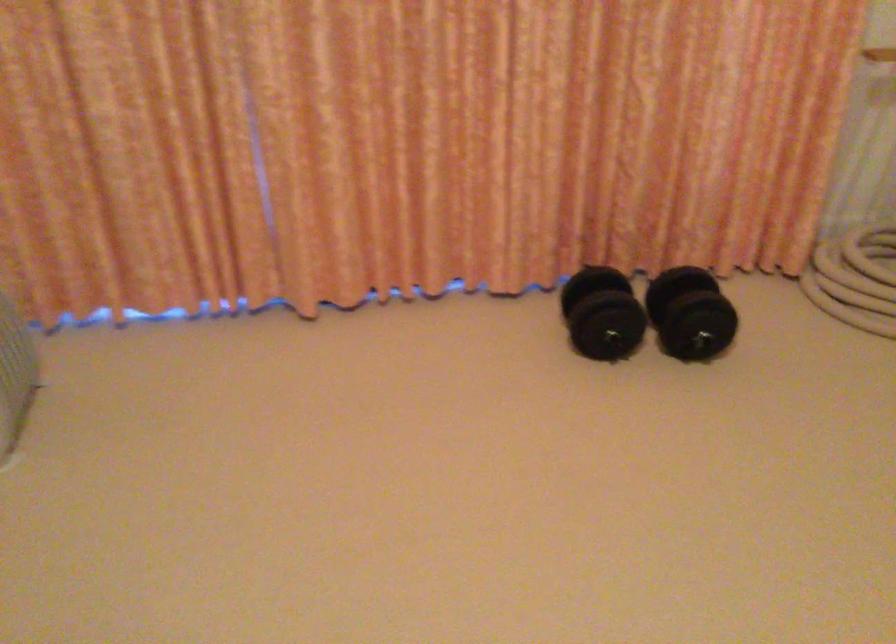
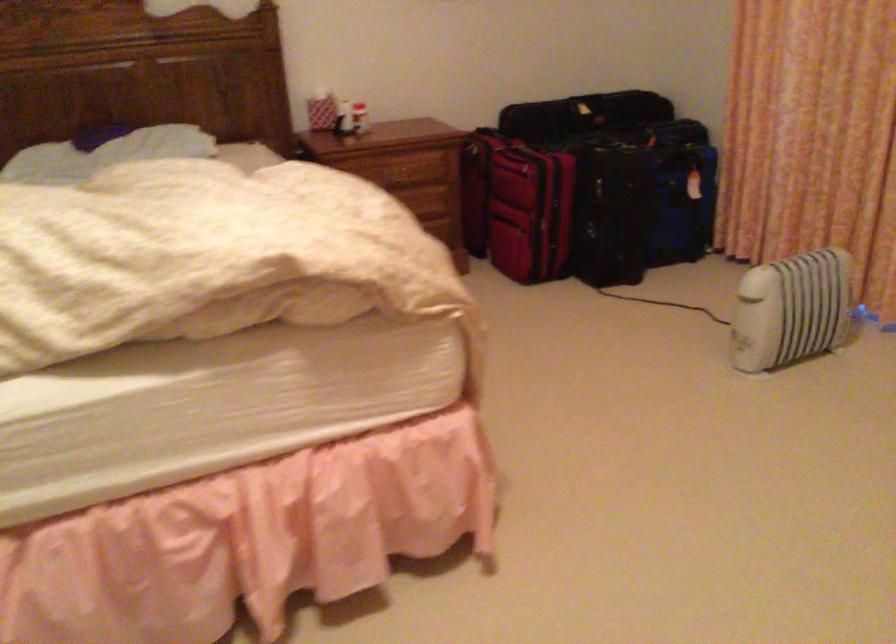
Question: The first image is from the beginning of the video and the second image is from the end. How did the camera likely rotate when shooting the video?

Choices:
 (A) Left
 (B) Right
 (C) Up
 (D) Down

Answer: (A)